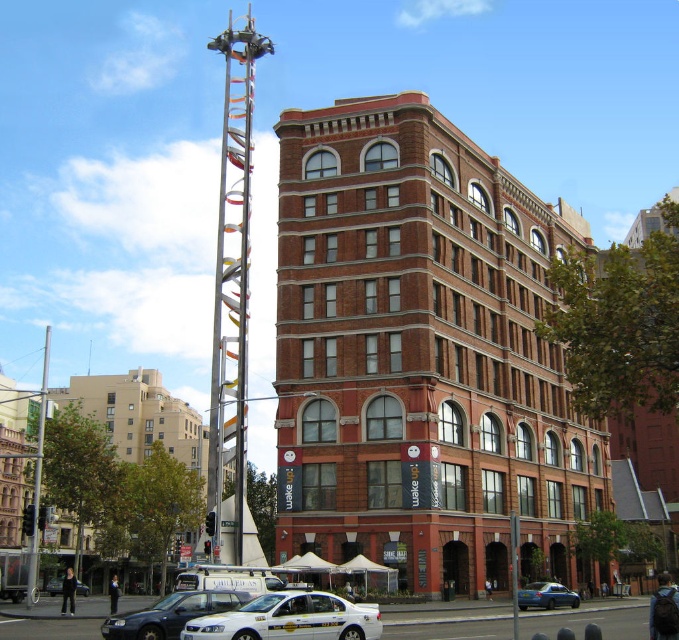
You are a pedestrian standing on the sidewalk in front of the multi story brick building. You see a white glossy taxi cab at lower center and a blue metallic sedan at lower center. Which vehicle is closer to you?

The white glossy taxi cab at lower center is positioned over the blue metallic sedan at lower center, meaning it is closer to you.

In the scene shown: You are a pedestrian standing on the sidewalk in front of the multi story brick building. You see a white plastic taxi at lower center and a blue metallic sedan at lower center. Which vehicle is taller?

The white plastic taxi at lower center is much taller than the blue metallic sedan at lower center.

You are a pedestrian standing on the sidewalk in front of the multi story brick building. You see a white glossy taxi cab at lower center and a white plastic taxi at lower center. Which one is more to the left?

The white glossy taxi cab at lower center is more to the left side of the white plastic taxi at lower center.